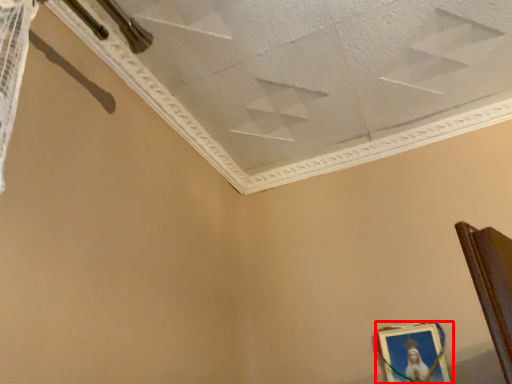
Question: From the image's perspective, where is picture frame (annotated by the red box) located in relation to wide in the image?

Choices:
 (A) above
 (B) below

Answer: (B)